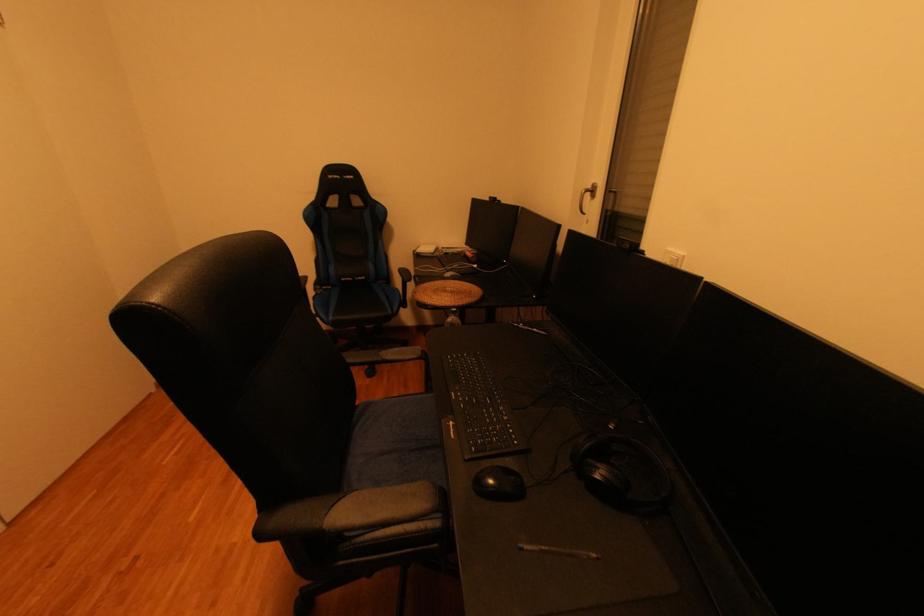
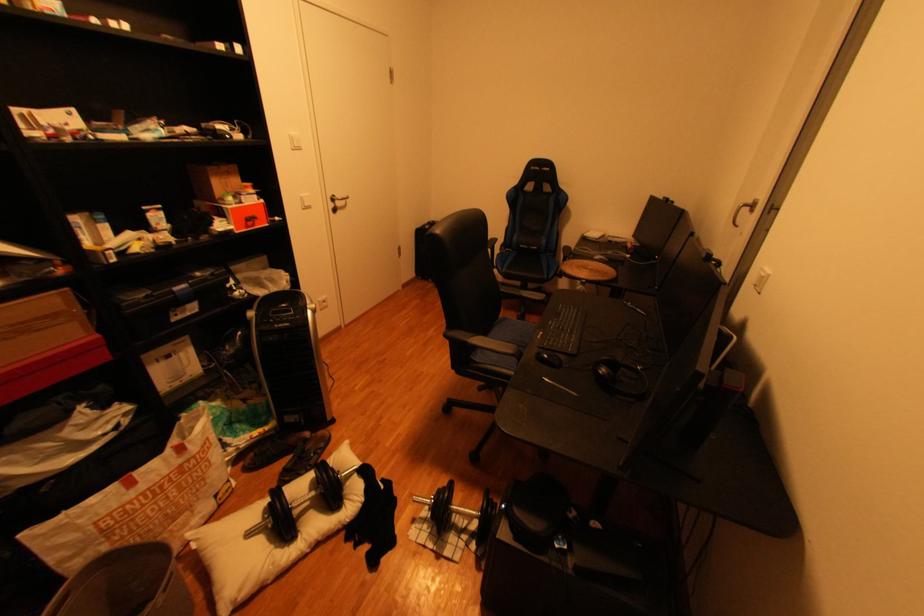
Find the pixel in the second image that matches [378,407] in the first image.

(515, 320)